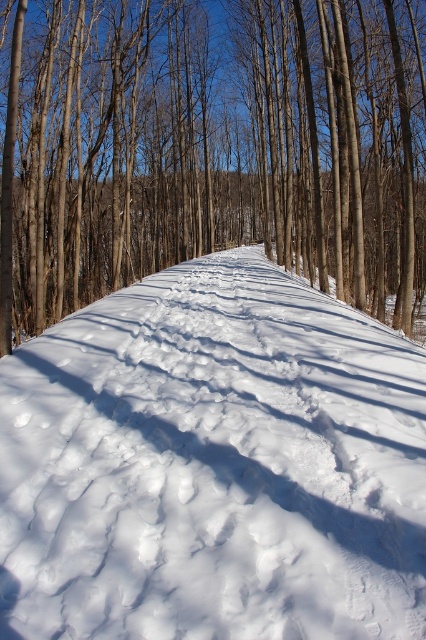
Who is more forward, (324, 460) or (405, 4)?

Point (324, 460) is in front.

Can you confirm if white fluffy snow at center is positioned above brown smooth tree at center?

Actually, white fluffy snow at center is below brown smooth tree at center.

Where is `white fluffy snow at center`? This screenshot has width=426, height=640. white fluffy snow at center is located at coordinates (213, 465).